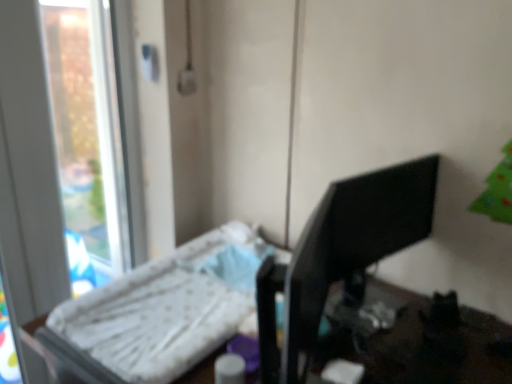
Question: Is transparent glass window at left a part of black glossy monitor at right?

Choices:
 (A) no
 (B) yes

Answer: (A)

Question: From the image's perspective, is black glossy monitor at right over transparent glass window at left?

Choices:
 (A) no
 (B) yes

Answer: (A)

Question: Does black glossy monitor at right have a greater width compared to transparent glass window at left?

Choices:
 (A) yes
 (B) no

Answer: (A)

Question: Is black glossy monitor at right to the left of transparent glass window at left from the viewer's perspective?

Choices:
 (A) yes
 (B) no

Answer: (B)

Question: Could you tell me if black glossy monitor at right is facing transparent glass window at left?

Choices:
 (A) no
 (B) yes

Answer: (A)

Question: Considering the relative positions of black glossy monitor at right and transparent glass window at left in the image provided, is black glossy monitor at right behind transparent glass window at left?

Choices:
 (A) no
 (B) yes

Answer: (A)

Question: From the image's perspective, would you say transparent glass window at left is shown under white fabric changing table at left?

Choices:
 (A) yes
 (B) no

Answer: (B)

Question: Is transparent glass window at left far from white fabric changing table at left?

Choices:
 (A) no
 (B) yes

Answer: (A)

Question: Does transparent glass window at left have a greater height compared to white fabric changing table at left?

Choices:
 (A) yes
 (B) no

Answer: (A)

Question: Is transparent glass window at left wider than white fabric changing table at left?

Choices:
 (A) yes
 (B) no

Answer: (B)

Question: Is white fabric changing table at left inside transparent glass window at left?

Choices:
 (A) no
 (B) yes

Answer: (A)

Question: Does transparent glass window at left appear on the left side of white fabric changing table at left?

Choices:
 (A) yes
 (B) no

Answer: (A)

Question: Would you say black glossy monitor at right contains white fabric changing table at left?

Choices:
 (A) no
 (B) yes

Answer: (A)